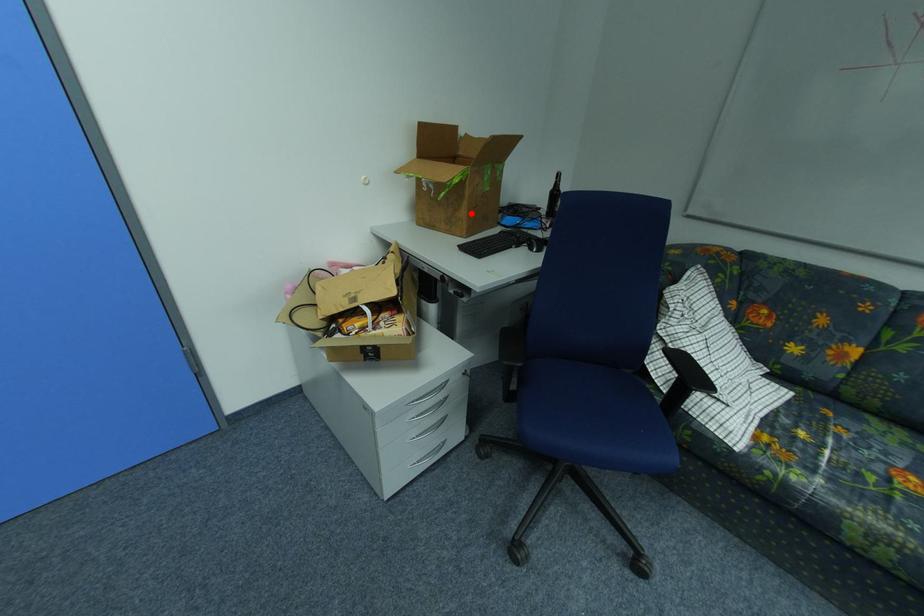
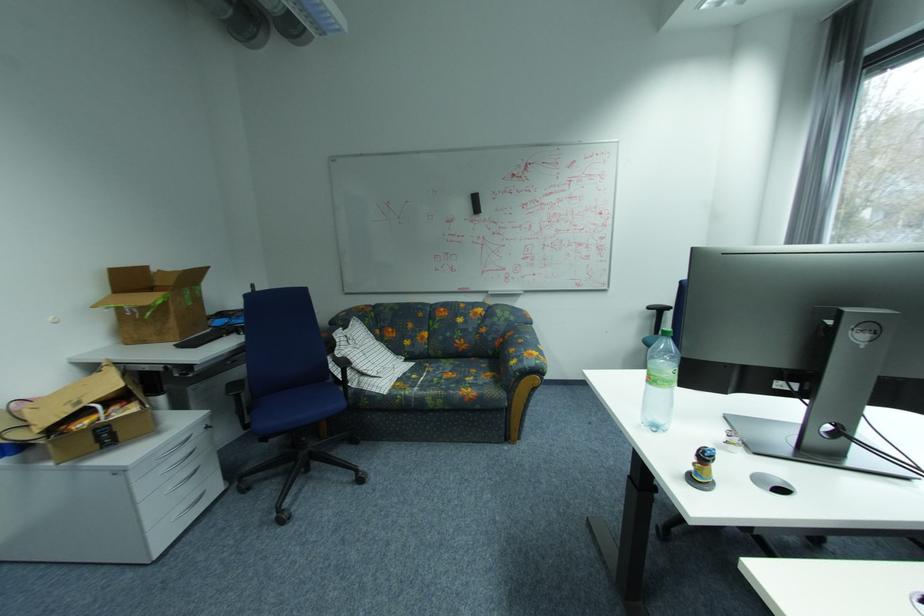
Where in the second image is the point corresponding to the highlighted location from the first image?

(180, 323)